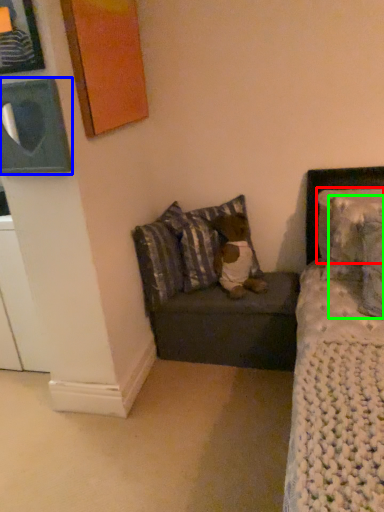
Question: Which object is positioned closest to pillow (highlighted by a red box)? Select from picture frame (highlighted by a blue box) and pillow (highlighted by a green box).

Choices:
 (A) picture frame
 (B) pillow

Answer: (B)